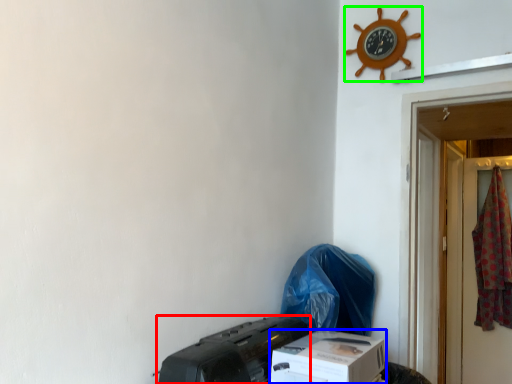
Question: Estimate the real-world distances between objects in this image. Which object is farther from printer (highlighted by a red box), box (highlighted by a blue box) or clock (highlighted by a green box)?

Choices:
 (A) box
 (B) clock

Answer: (B)